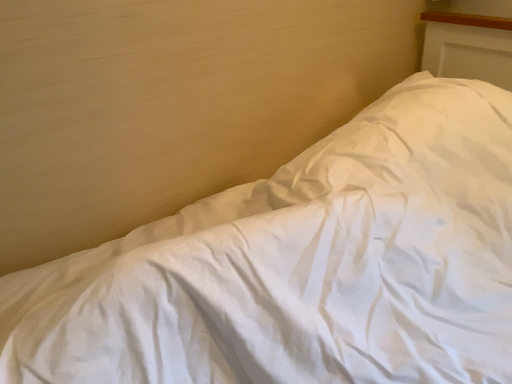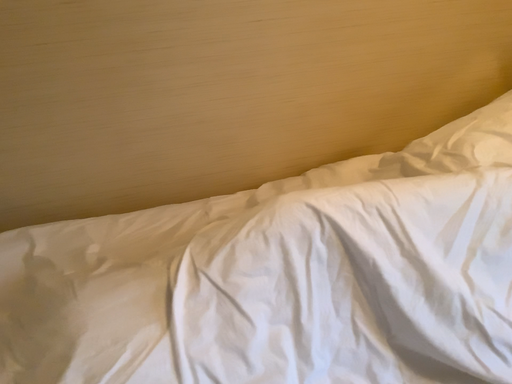
Question: How did the camera likely rotate when shooting the video?

Choices:
 (A) rotated right
 (B) rotated left

Answer: (B)